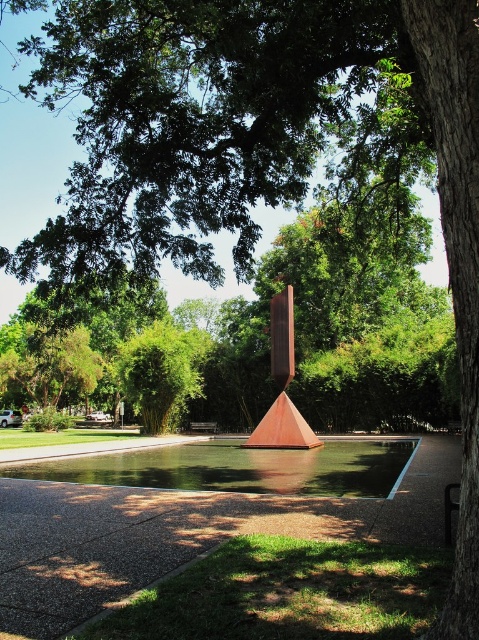
You are a landscape architect designing a new garden. You have a limited space and need to place both the green bamboo at center and the rusty metal sculpture at center. Which object should you prioritize placing first if you want to ensure there is enough space for both?

The green bamboo at center is bigger than the rusty metal sculpture at center, so you should prioritize placing the green bamboo at center first to ensure there is enough space for both.